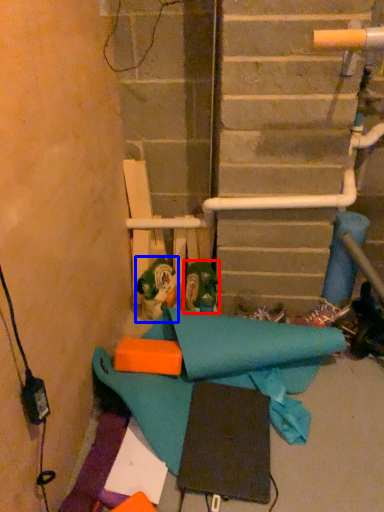
Question: Which object is further to the camera taking this photo, footwear (highlighted by a red box) or toy (highlighted by a blue box)?

Choices:
 (A) footwear
 (B) toy

Answer: (B)